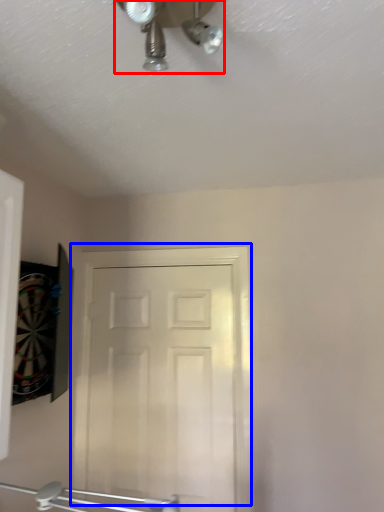
Question: Which point is further to the camera, mechanical fan (highlighted by a red box) or door (highlighted by a blue box)?

Choices:
 (A) mechanical fan
 (B) door

Answer: (B)